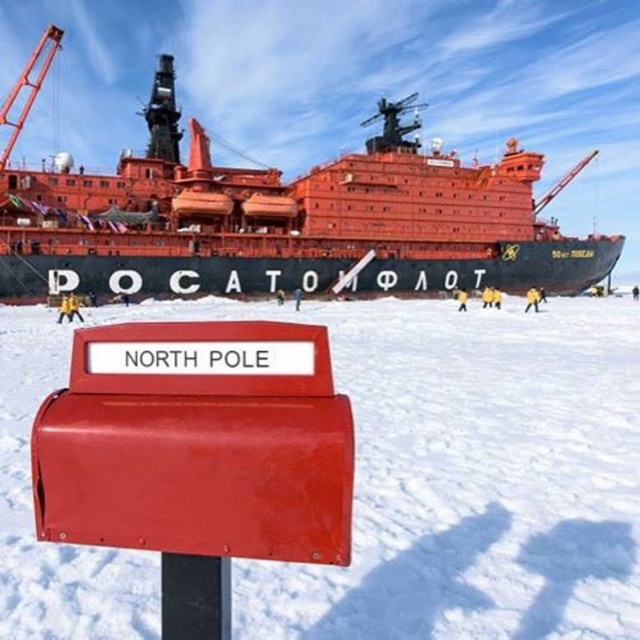
You are a photographer planning to take a wide shot of the white matte snow at center and the metallic red crane at upper left. Based on their sizes in the image, which object would likely occupy more of the frame horizontally?

The white matte snow at center might be wider than the metallic red crane at upper left, so it would likely occupy more horizontal space in the frame.

You are a photographer standing near the mailbox at the North Pole. You want to take a photo that includes both the shiny orange ship at upper center and the metallic red crane at upper left. Based on their positions, which object should appear lower in the photo?

The shiny orange ship at upper center should appear lower in the photo because it is positioned below the metallic red crane at upper left.